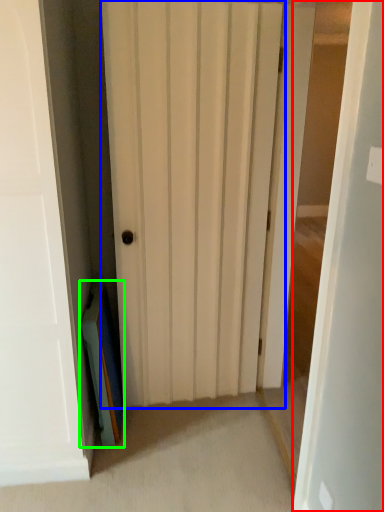
Question: Which object is the closest to the door (highlighted by a red box)? Choose among these: door (highlighted by a blue box) or book (highlighted by a green box).

Choices:
 (A) door
 (B) book

Answer: (A)